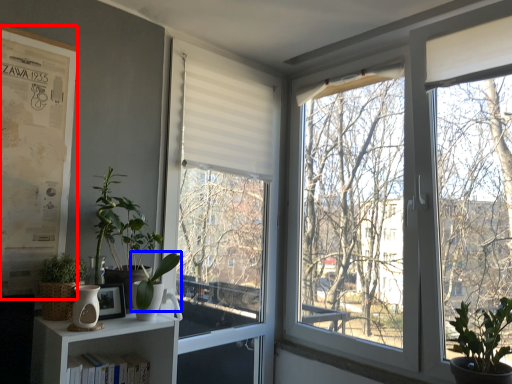
Question: Which object appears closest to the camera in this image, bulletin board (highlighted by a red box) or plant (highlighted by a blue box)?

Choices:
 (A) bulletin board
 (B) plant

Answer: (B)